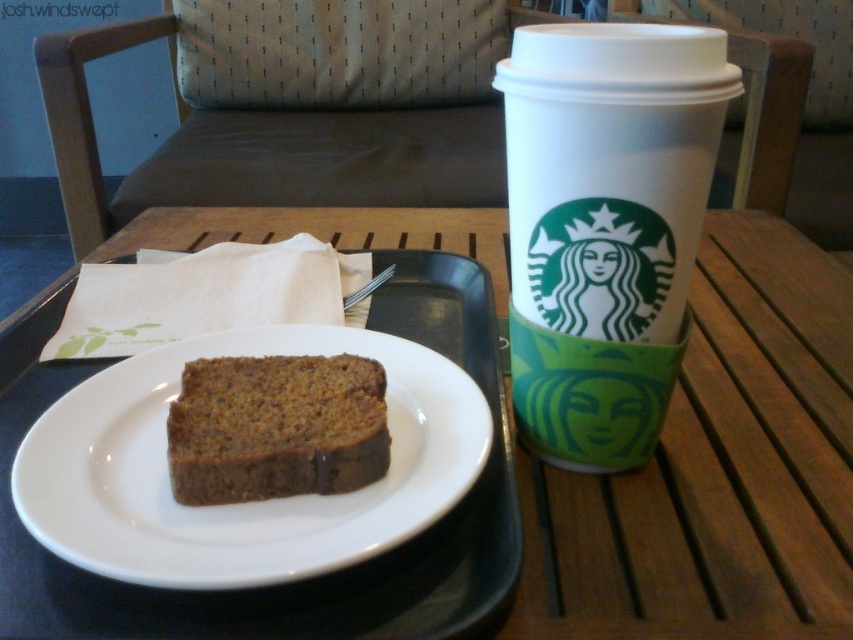
Question: Can you confirm if white paper cup at upper right is bigger than chocolatesmoothcake at center?

Choices:
 (A) yes
 (B) no

Answer: (A)

Question: Can you confirm if white ceramic plate at center is positioned to the left of chocolatesmoothcake at center?

Choices:
 (A) yes
 (B) no

Answer: (A)

Question: Among these objects, which one is farthest from the camera?

Choices:
 (A) wooden table at center
 (B) white ceramic plate at center
 (C) white paper cup at upper right
 (D) chocolatesmoothcake at center

Answer: (D)

Question: Is white paper cup at upper right to the right of chocolatesmoothcake at center from the viewer's perspective?

Choices:
 (A) yes
 (B) no

Answer: (A)

Question: Which is farther from the white paper cup at upper right?

Choices:
 (A) wooden table at center
 (B) white ceramic plate at center
 (C) chocolatesmoothcake at center

Answer: (A)

Question: Which of these objects is positioned closest to the white paper cup at upper right?

Choices:
 (A) white ceramic plate at center
 (B) chocolatesmoothcake at center
 (C) wooden table at center

Answer: (A)